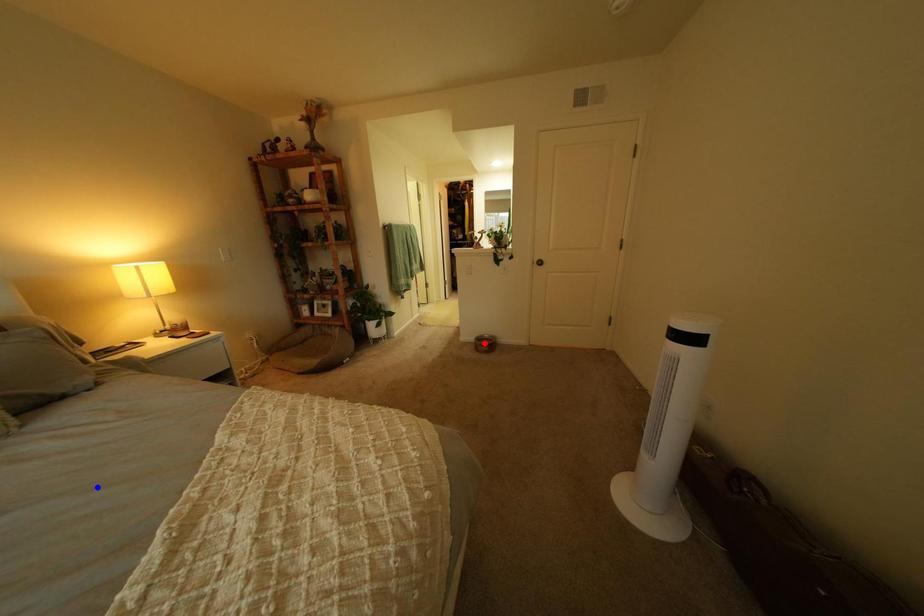
Question: Which of the two points in the image is closer to the camera?

Choices:
 (A) Blue point is closer.
 (B) Red point is closer.

Answer: (A)